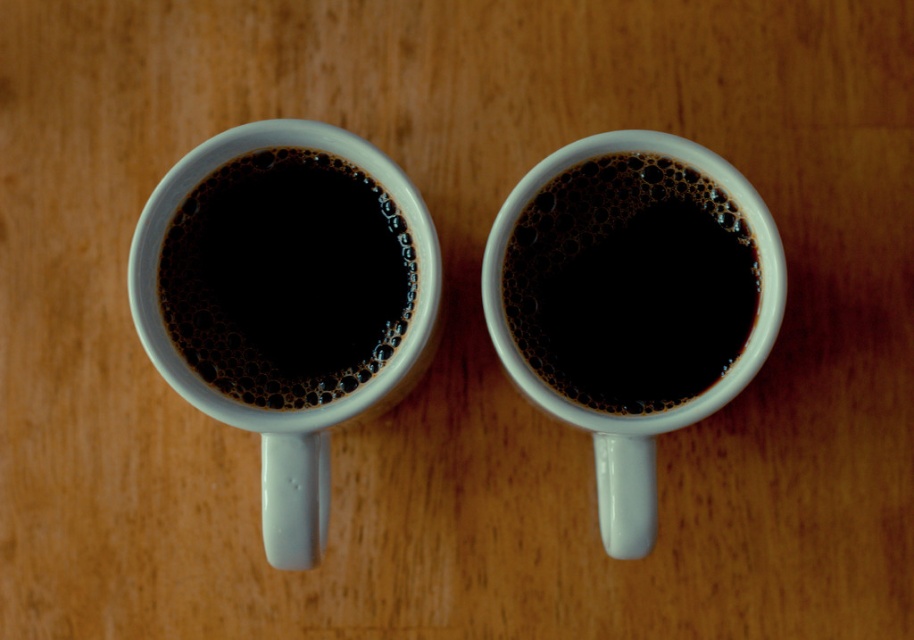
Is white glossy mug at upper center in front of matte ceramic coffee cup at center?

Yes, white glossy mug at upper center is closer to the viewer.

Is point (349, 163) closer to viewer compared to point (629, 202)?

Yes, it is.

Who is more distant from viewer, (x=275, y=192) or (x=555, y=248)?

Positioned behind is point (x=555, y=248).

This screenshot has width=914, height=640. What are the coordinates of `white glossy mug at upper center` in the screenshot? It's located at (285, 300).

Does point (289, 305) lie in front of point (396, 237)?

That is False.

Identify the location of white glossy mug at upper center. (285, 300).

Between matte ceramic cup at center and matte ceramic coffee cup at center, which one is positioned higher?

matte ceramic cup at center

Who is more forward, (x=274, y=150) or (x=655, y=276)?

Point (x=274, y=150) is in front.

In order to click on matte ceramic cup at center in this screenshot , I will do `click(285, 278)`.